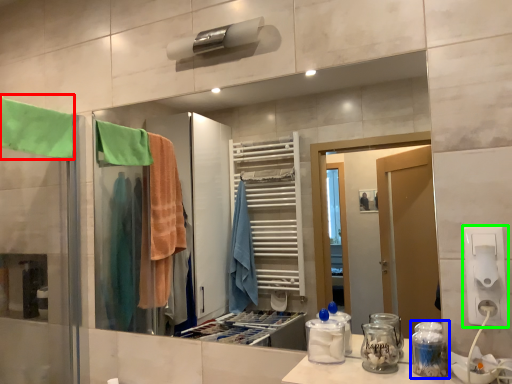
Question: Estimate the real-world distances between objects in this image. Which object is closer to beach towel (highlighted by a red box), glass jar (highlighted by a blue box) or electric outlet (highlighted by a green box)?

Choices:
 (A) glass jar
 (B) electric outlet

Answer: (A)